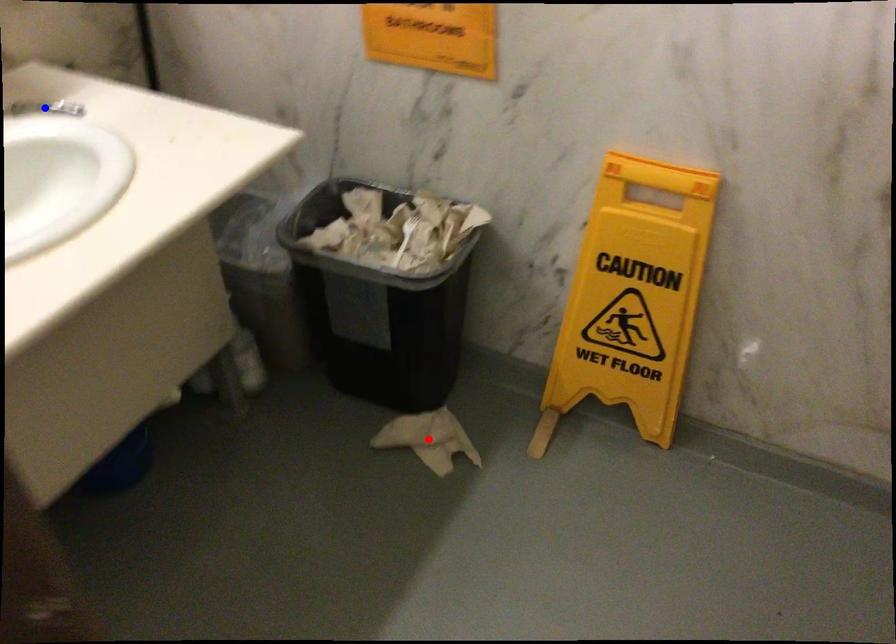
Question: Two points are marked on the image. Which point is closer to the camera?

Choices:
 (A) Blue point is closer.
 (B) Red point is closer.

Answer: (A)